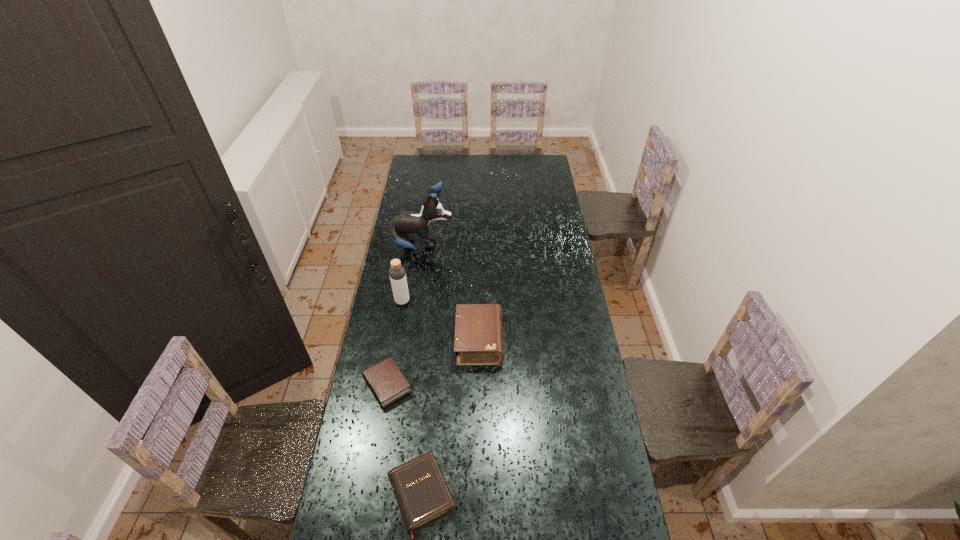
Image resolution: width=960 pixels, height=540 pixels. What are the coordinates of `Bible that is the closest to the bottle` in the screenshot? It's located at (478, 340).

What are the coordinates of `free space that satisfies the following two spatial constraints: 1. on the front-facing side of the puppy; 2. on the front side of the fourth nearest object` in the screenshot? It's located at (415, 301).